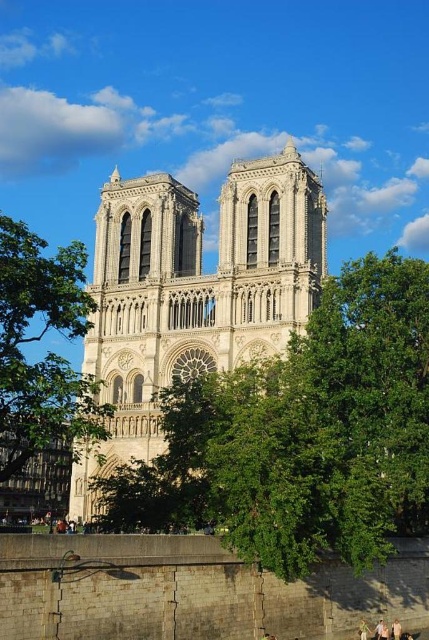
You are standing in front of Notre Dame Cathedral and see a light brown wooden chair at lower center and a light brown wooden person at center. Which object is larger in size?

The light brown wooden chair at lower center is bigger than the light brown wooden person at center.

You are a photographer standing at the lower center of the scene with a camera. You want to capture a photo of the Notre Dame Cathedral without any obstructions. However, there is a green leafy tree at left and a light brown hair at lower center in your view. Which object is wider and might block your view more if you position yourself directly in front of the cathedral?

The green leafy tree at left might be wider than the light brown hair at lower center, so it could block your view more if positioned directly in front of the cathedral.